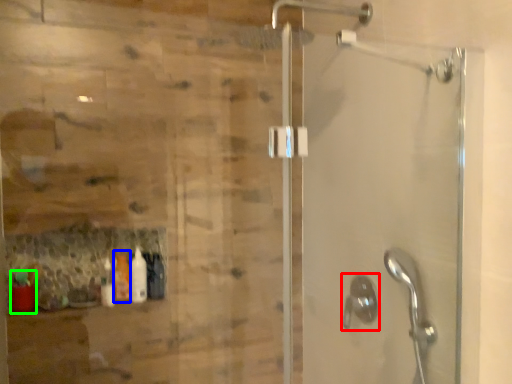
Question: Which object is the farthest from shower (highlighted by a red box)? Choose among these: bottle (highlighted by a blue box) or bottle (highlighted by a green box).

Choices:
 (A) bottle
 (B) bottle

Answer: (B)